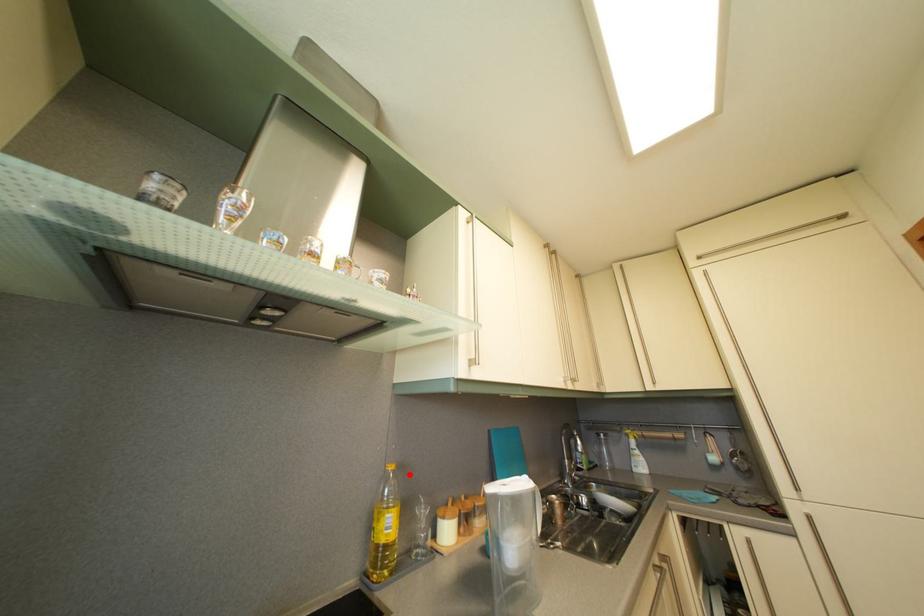
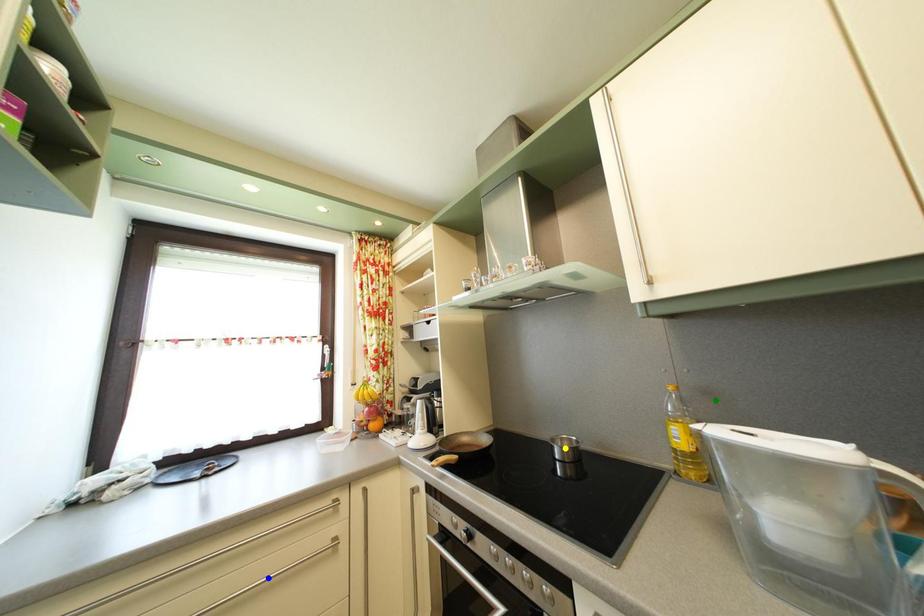
Question: I am providing you with two images of the same scene from different viewpoints. A red point is marked on the first image. You are given multiple points on the second image. Can you choose the point in image 2 that corresponds to the point in image 1?

Choices:
 (A) yellow point
 (B) blue point
 (C) green point

Answer: (C)